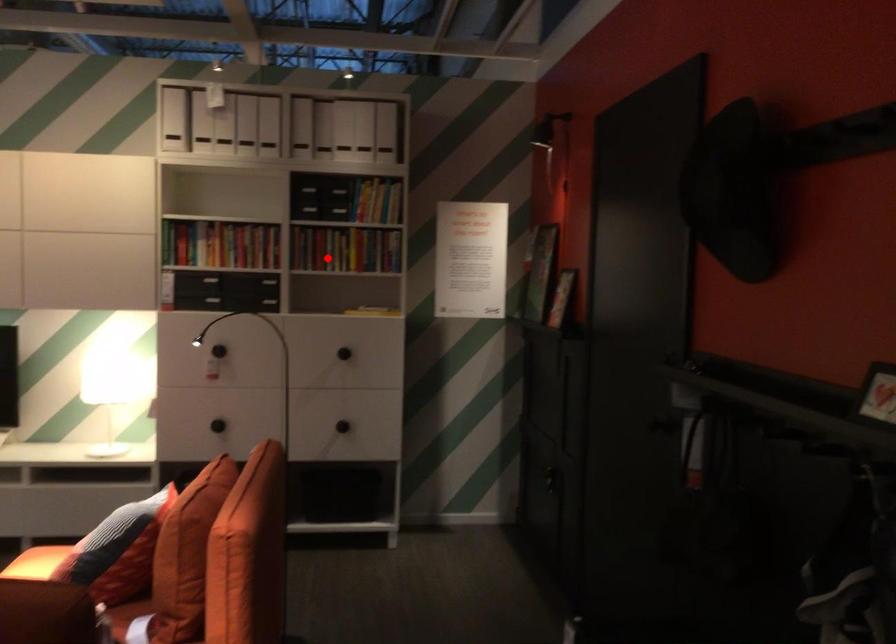
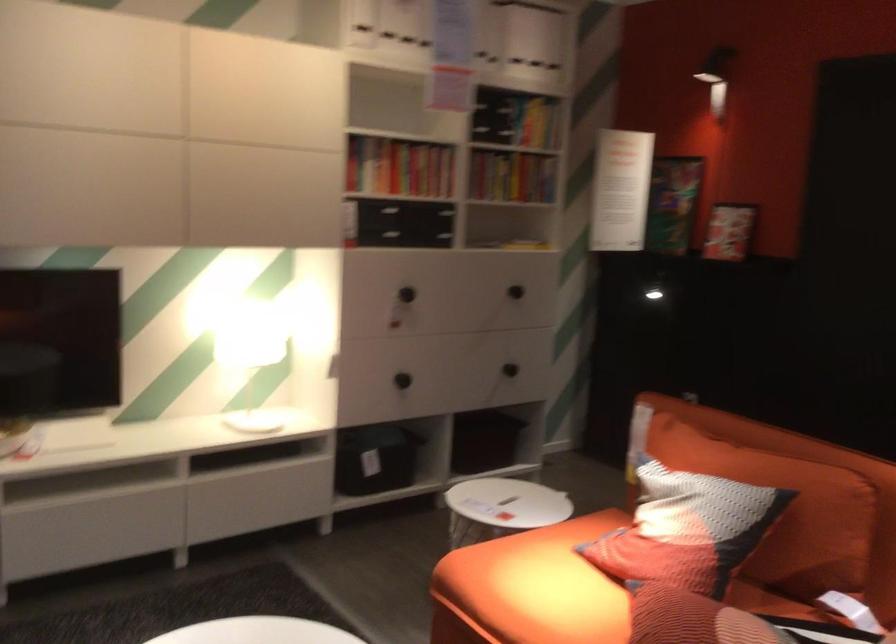
Locate, in the second image, the point that corresponds to the highlighted location in the first image.

(512, 176)